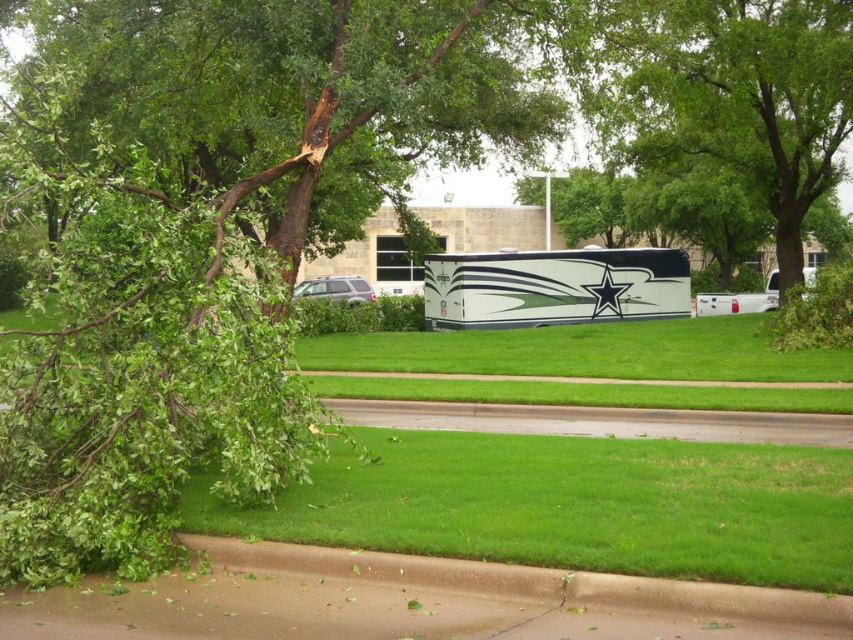
Is point (241, 128) closer to camera compared to point (630, 296)?

Yes, it is.

Where is `green rough bark tree at left`? green rough bark tree at left is located at coordinates click(x=210, y=228).

Is point (598, 561) in front of point (476, 294)?

Yes, point (598, 561) is closer to viewer.

Which is more to the right, green grass at lower center or white glossy tour bus at center?

white glossy tour bus at center

Where is `green grass at lower center`? The width and height of the screenshot is (853, 640). green grass at lower center is located at coordinates (566, 504).

Who is more forward, (380, 102) or (294, 298)?

Positioned in front is point (380, 102).

Does green rough bark tree at left come in front of satin silver suv at center?

Yes.

The image size is (853, 640). In order to click on green rough bark tree at left in this screenshot , I will do `click(210, 228)`.